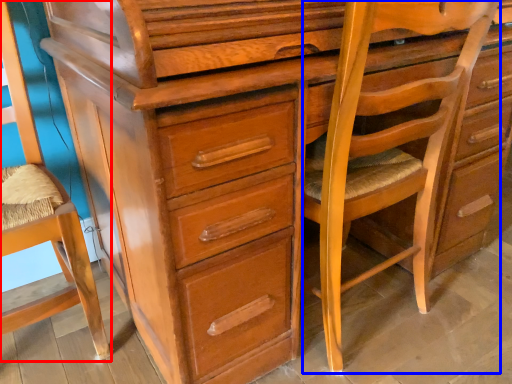
Question: Which point is further to the camera, swivel chair (highlighted by a red box) or rocking chair (highlighted by a blue box)?

Choices:
 (A) swivel chair
 (B) rocking chair

Answer: (B)